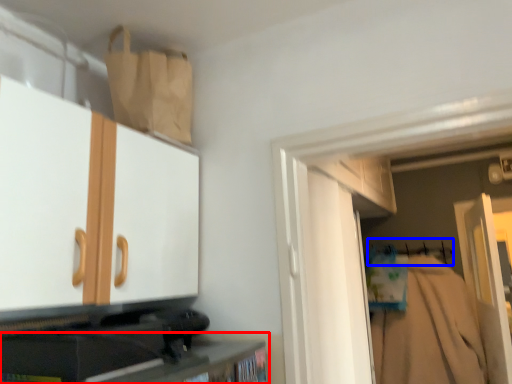
Question: Which of the following is the farthest to the observer, cabinetry (highlighted by a red box) or hanger (highlighted by a blue box)?

Choices:
 (A) cabinetry
 (B) hanger

Answer: (B)